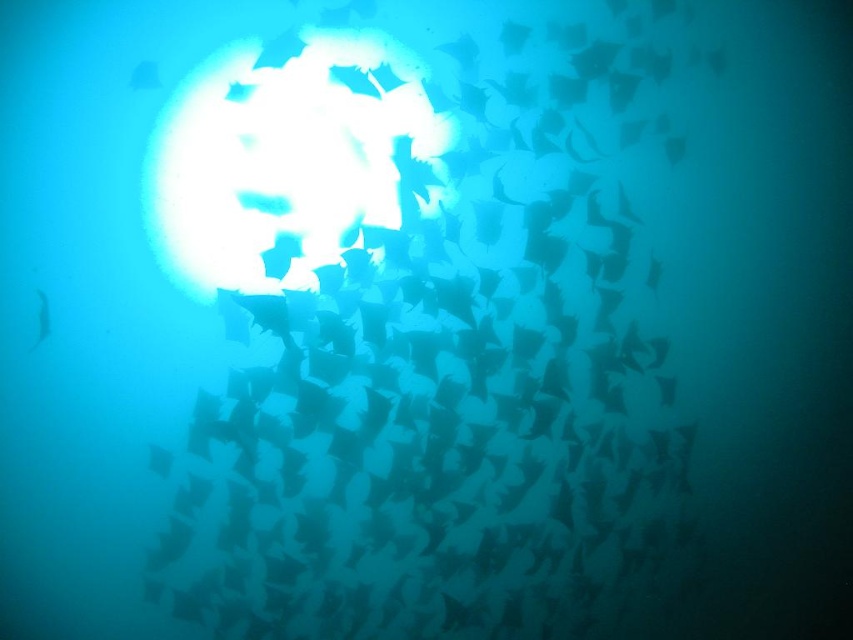
You are a marine biologist observing an underwater scene. You notice a translucent white fish at center. Based on its position, what coordinates would you record for its location?

The translucent white fish at center is located at coordinates point (444, 419).

You are a marine biologist observing the underwater scene. You notice two fish species in the image. The first is the translucent white fish at center, and the second is the translucent blue fish at left. Based on their positions and the light conditions, which fish might have a larger width when viewed from above?

The translucent white fish at center might be wider than the translucent blue fish at left, so it likely has a larger width when viewed from above.